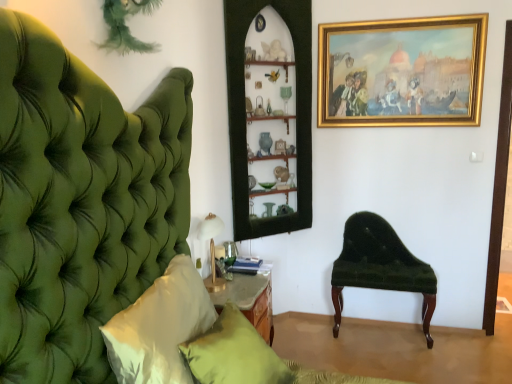
In order to click on free point above gold/gilded picture frame at upper right (from a real-world perspective) in this screenshot , I will do `click(396, 18)`.